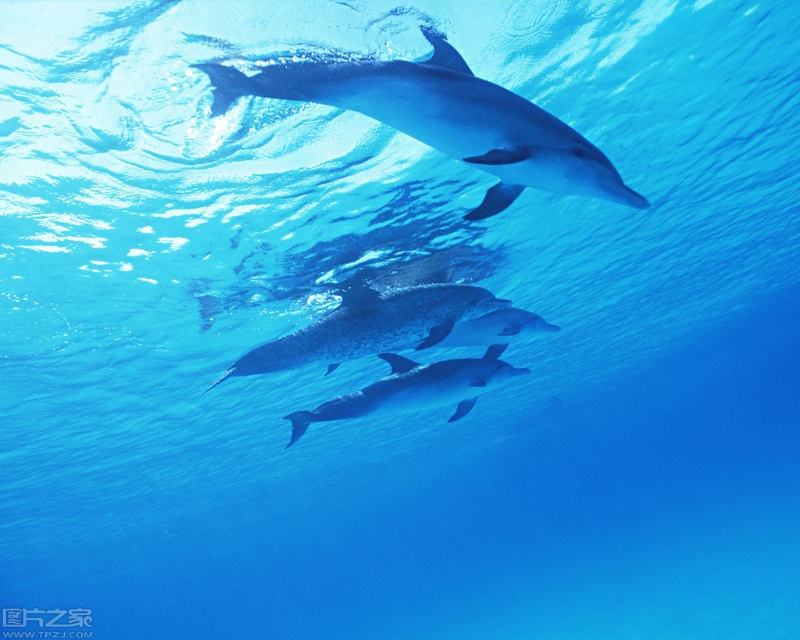
Is point (484, 106) farther from viewer compared to point (316, 410)?

That is False.

How distant is sleek silver dolphin at upper center from glossy white dolphin at center?

The distance of sleek silver dolphin at upper center from glossy white dolphin at center is 3.40 meters.

Which is in front, point (454, 76) or point (324, 412)?

Point (454, 76)

Image resolution: width=800 pixels, height=640 pixels. In order to click on sleek silver dolphin at upper center in this screenshot , I will do `click(445, 120)`.

Between speckled blue dolphin at center and glossy white dolphin at center, which one has less height?

speckled blue dolphin at center is shorter.

Between speckled blue dolphin at center and glossy white dolphin at center, which one appears on the right side from the viewer's perspective?

speckled blue dolphin at center is more to the right.

Does point (377, 326) lie in front of point (464, 362)?

Yes, point (377, 326) is in front of point (464, 362).

What are the coordinates of `speckled blue dolphin at center` in the screenshot? It's located at (370, 326).

What are the coordinates of `sleek silver dolphin at upper center` in the screenshot? It's located at (445, 120).

Is sleek silver dolphin at upper center further to camera compared to speckled blue dolphin at center?

That is False.

This screenshot has width=800, height=640. What are the coordinates of `sleek silver dolphin at upper center` in the screenshot? It's located at (445, 120).

Where is `sleek silver dolphin at upper center`? sleek silver dolphin at upper center is located at coordinates (445, 120).